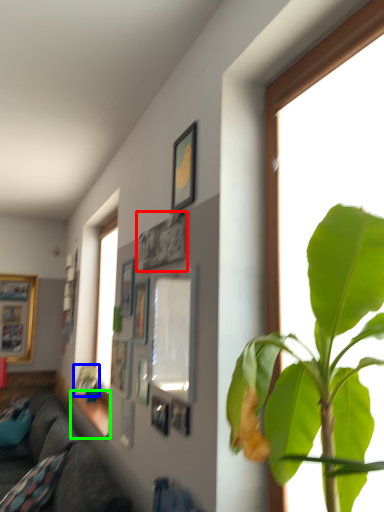
Question: Estimate the real-world distances between objects in this image. Which object is farther from picture frame (highlighted by a red box), picture frame (highlighted by a blue box) or window sill (highlighted by a green box)?

Choices:
 (A) picture frame
 (B) window sill

Answer: (A)